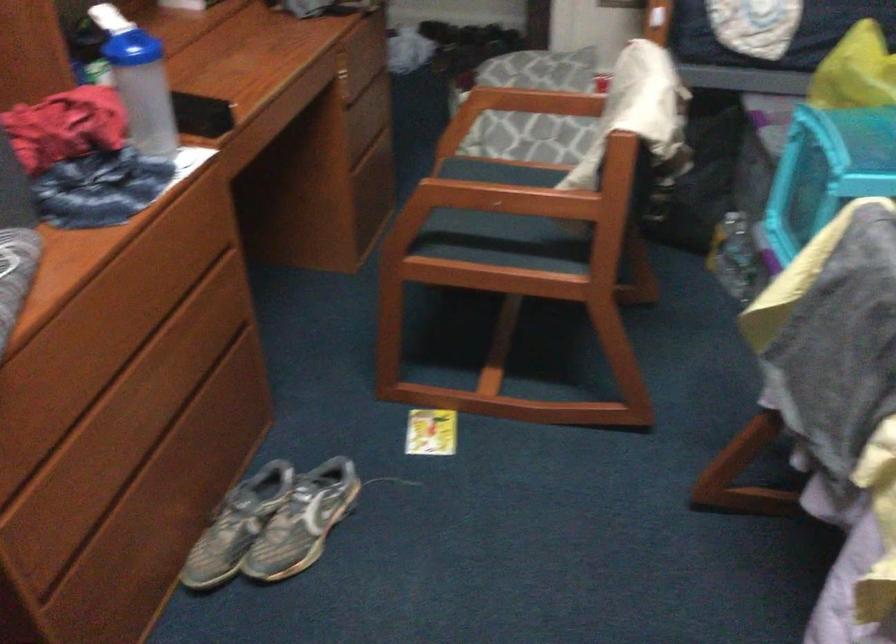
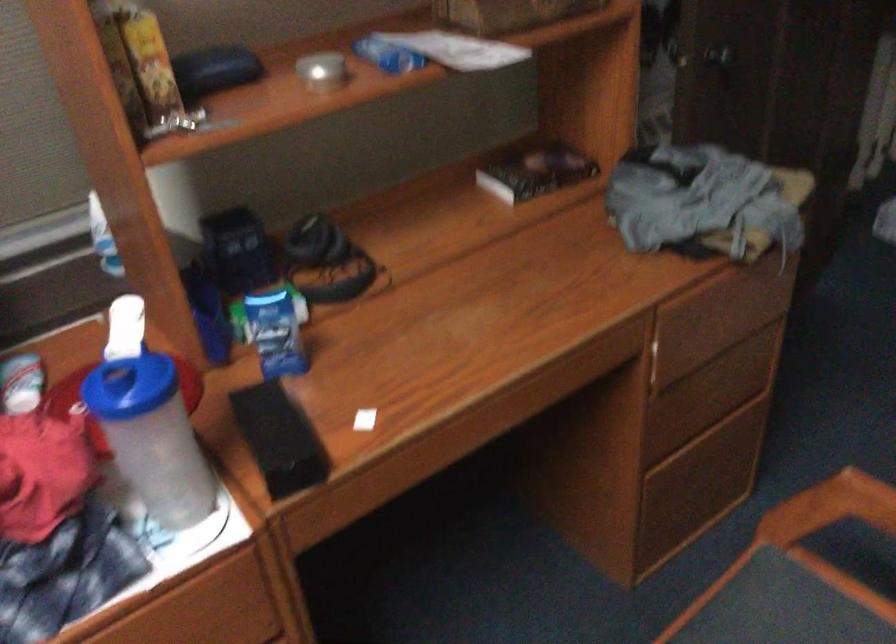
In the second image, find the point that corresponds to point (470, 111) in the first image.

(830, 507)